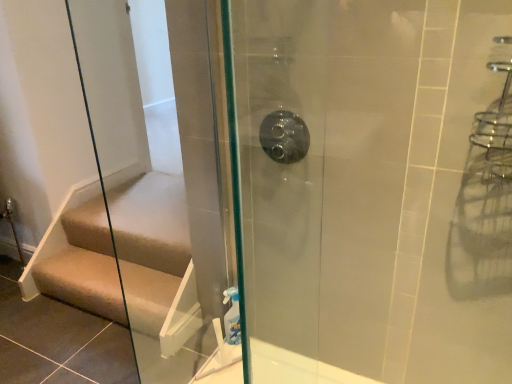
This screenshot has height=384, width=512. What do you see at coordinates (83, 281) in the screenshot? I see `brown leather stairs at lower left` at bounding box center [83, 281].

Measure the distance between point (108, 281) and camera.

A distance of 6.62 feet exists between point (108, 281) and camera.

This screenshot has height=384, width=512. What are the coordinates of `brown leather stairs at lower left` in the screenshot? It's located at (83, 281).

You are a GUI agent. You are given a task and a screenshot of the screen. Output one action in this format:
    pyautogui.click(x=<x>, y=<y>)
    Task: Click on the matte silver showerhead at center
    The image size is (512, 384).
    Given the screenshot: What is the action you would take?
    pyautogui.click(x=284, y=137)

Describe the element at coordinates (284, 137) in the screenshot. The height and width of the screenshot is (384, 512). I see `matte silver showerhead at center` at that location.

The height and width of the screenshot is (384, 512). I want to click on brown leather stairs at lower left, so pos(83,281).

Which object is positioned more to the right, matte silver showerhead at center or brown leather stairs at lower left?

Positioned to the right is matte silver showerhead at center.

Does matte silver showerhead at center come in front of brown leather stairs at lower left?

Yes, the depth of matte silver showerhead at center is less than that of brown leather stairs at lower left.

In the scene shown: Which is closer to the camera, (264, 151) or (148, 316)?

The point (264, 151) is in front.

From the image's perspective, which one is positioned higher, matte silver showerhead at center or brown leather stairs at lower left?

From the image's view, matte silver showerhead at center is above.

From a real-world perspective, is matte silver showerhead at center located beneath brown leather stairs at lower left?

No.

Considering the relative sizes of matte silver showerhead at center and brown leather stairs at lower left in the image provided, is matte silver showerhead at center thinner than brown leather stairs at lower left?

Yes, matte silver showerhead at center is thinner than brown leather stairs at lower left.

Who is taller, matte silver showerhead at center or brown leather stairs at lower left?

Standing taller between the two is matte silver showerhead at center.

Between matte silver showerhead at center and brown leather stairs at lower left, which one has larger size?

Bigger between the two is brown leather stairs at lower left.

Is brown leather stairs at lower left inside matte silver showerhead at center?

No, brown leather stairs at lower left is located outside of matte silver showerhead at center.

Is matte silver showerhead at center positioned far away from brown leather stairs at lower left?

Indeed, matte silver showerhead at center is not near brown leather stairs at lower left.

Is matte silver showerhead at center looking in the opposite direction of brown leather stairs at lower left?

No, matte silver showerhead at center is not facing the opposite direction of brown leather stairs at lower left.

The height and width of the screenshot is (384, 512). Identify the location of stairs on the left of matte silver showerhead at center. (83, 281).

Between brown leather stairs at lower left and matte silver showerhead at center, which one appears on the right side from the viewer's perspective?

matte silver showerhead at center.

Considering the positions of objects brown leather stairs at lower left and matte silver showerhead at center in the image provided, who is behind, brown leather stairs at lower left or matte silver showerhead at center?

brown leather stairs at lower left is further away from the camera.

Does point (119, 298) come in front of point (266, 116)?

No, it is not.

In the scene shown: From the image's perspective, does brown leather stairs at lower left appear higher than matte silver showerhead at center?

Incorrect, from the image's perspective, brown leather stairs at lower left is lower than matte silver showerhead at center.

Based on the photo, from a real-world perspective, who is located lower, brown leather stairs at lower left or matte silver showerhead at center?

In real-world perspective, brown leather stairs at lower left is lower.

Is brown leather stairs at lower left wider or thinner than matte silver showerhead at center?

Clearly, brown leather stairs at lower left has more width compared to matte silver showerhead at center.

Considering the relative sizes of brown leather stairs at lower left and matte silver showerhead at center in the image provided, is brown leather stairs at lower left shorter than matte silver showerhead at center?

Yes.

Is brown leather stairs at lower left smaller than matte silver showerhead at center?

No, brown leather stairs at lower left is not smaller than matte silver showerhead at center.

Would you say brown leather stairs at lower left is inside or outside matte silver showerhead at center?

brown leather stairs at lower left is not inside matte silver showerhead at center, it's outside.

Is brown leather stairs at lower left far away from matte silver showerhead at center?

Yes, brown leather stairs at lower left is far from matte silver showerhead at center.

Is brown leather stairs at lower left facing towards matte silver showerhead at center?

No, brown leather stairs at lower left is not facing towards matte silver showerhead at center.

Locate an element on the screen. stairs behind the matte silver showerhead at center is located at coordinates (83, 281).

In order to click on stairs below the matte silver showerhead at center (from a real-world perspective) in this screenshot , I will do `click(83, 281)`.

Locate an element on the screen. This screenshot has width=512, height=384. stairs located on the left of matte silver showerhead at center is located at coordinates (83, 281).